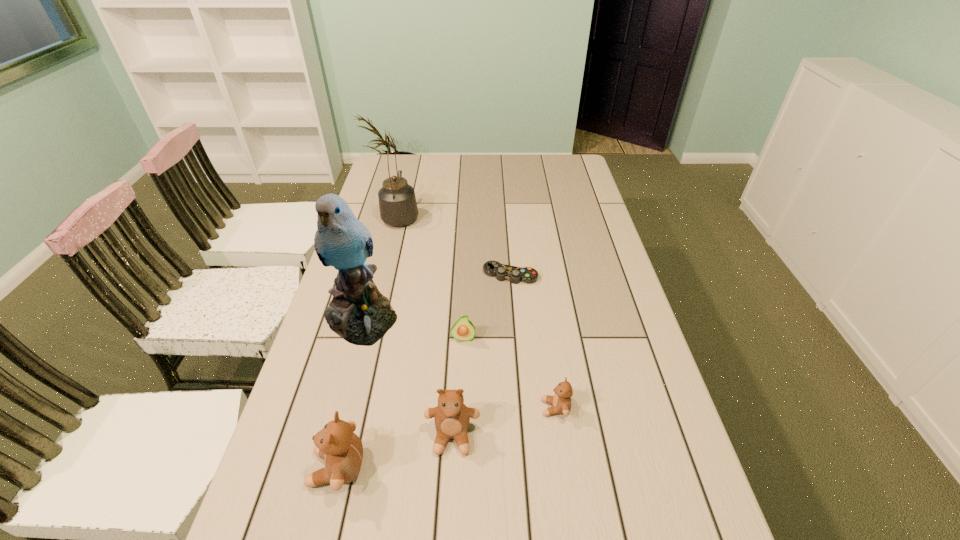
This screenshot has width=960, height=540. Find the location of `vacant space situated 0.080m on the front-facing side of the leftmost teddy bear`. vacant space situated 0.080m on the front-facing side of the leftmost teddy bear is located at coordinates (274, 468).

What are the coordinates of `free location located on the front-facing side of the leftmost teddy bear` in the screenshot? It's located at (278, 468).

In order to click on vacant space located on the front-facing side of the rightmost teddy bear in this screenshot , I will do `click(474, 408)`.

You are a GUI agent. You are given a task and a screenshot of the screen. Output one action in this format:
    pyautogui.click(x=<x>, y=<y>)
    Task: Click on the vacant space located 0.280m on the front-facing side of the rightmost teddy bear
    
    Given the screenshot: What is the action you would take?
    pyautogui.click(x=424, y=408)

At what (x,y) coordinates should I click in order to perform the action: click on vacant space situated 0.270m on the front-facing side of the rightmost teddy bear. Please return your answer as a coordinate pair (x, y). The width and height of the screenshot is (960, 540). Looking at the image, I should click on (428, 408).

In order to click on vacant space located spout on the kettle in this screenshot , I will do `click(412, 167)`.

In order to click on blank space located 0.070m spout on the kettle in this screenshot , I will do `click(406, 192)`.

Locate an element on the screen. free space located 0.350m spout on the kettle is located at coordinates pyautogui.click(x=414, y=159).

Image resolution: width=960 pixels, height=540 pixels. I want to click on blank area located on the right of the sixth nearest object, so click(x=594, y=275).

Find the location of `blank space located 0.360m on the cut side of the avocado`. blank space located 0.360m on the cut side of the avocado is located at coordinates (458, 478).